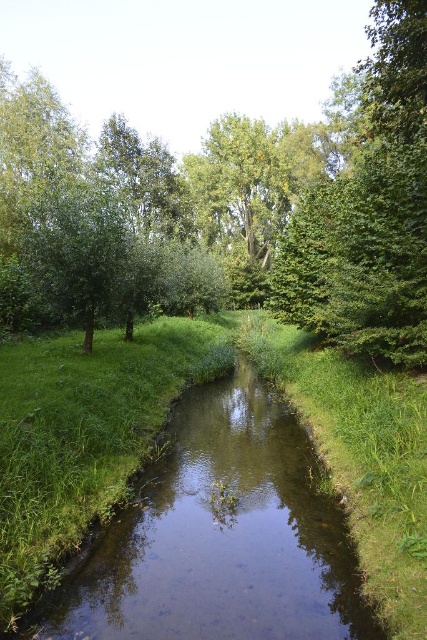
You are planning to place a small wooden bridge over the stream. The bridge you have is 30 meters long. Based on the distance between the green leafy tree at center and the green grassy stream at center, will the bridge span the stream adequately?

The green leafy tree at center and green grassy stream at center are 28.91 meters apart. Since the bridge is 30 meters long, it will span the stream adequately as it is longer than the distance between them.